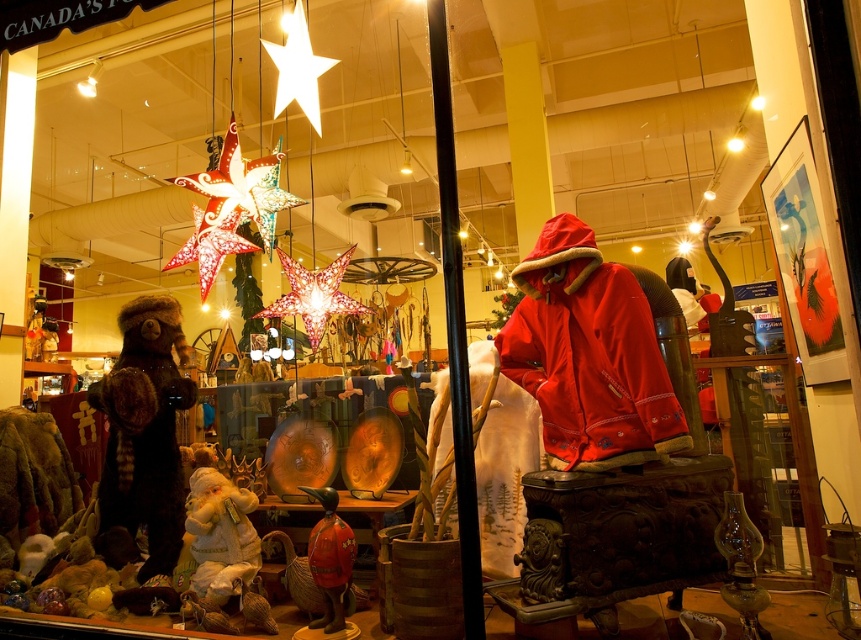
You are a GUI agent. You are given a task and a screenshot of the screen. Output one action in this format:
    pyautogui.click(x=<x>, y=<y>)
    Task: Click on the red fleece jacket at center
    The image size is (861, 640).
    Given the screenshot: What is the action you would take?
    pyautogui.click(x=589, y=355)

Is red fleece jacket at center to the right of white plush santa at center from the viewer's perspective?

Yes, red fleece jacket at center is to the right of white plush santa at center.

Is point (642, 410) farther from viewer compared to point (249, 547)?

No.

At what (x,y) coordinates should I click in order to perform the action: click on red fleece jacket at center. Please return your answer as a coordinate pair (x, y). The height and width of the screenshot is (640, 861). Looking at the image, I should click on (589, 355).

What do you see at coordinates (589, 355) in the screenshot?
I see `red fleece jacket at center` at bounding box center [589, 355].

Does point (550, 257) lie in front of point (147, 332)?

Yes, point (550, 257) is in front of point (147, 332).

Describe the element at coordinates (589, 355) in the screenshot. I see `red fleece jacket at center` at that location.

You are a GUI agent. You are given a task and a screenshot of the screen. Output one action in this format:
    pyautogui.click(x=<x>, y=<y>)
    Task: Click on the red fleece jacket at center
    The height and width of the screenshot is (640, 861).
    Given the screenshot: What is the action you would take?
    (589, 355)

Does white plush santa at center appear on the right side of shiny red duck at center?

No, white plush santa at center is not to the right of shiny red duck at center.

Which is in front, point (220, 483) or point (329, 548)?

Point (329, 548)

What are the coordinates of `white plush santa at center` in the screenshot? It's located at (220, 534).

Where is `white plush santa at center`? The width and height of the screenshot is (861, 640). white plush santa at center is located at coordinates (220, 534).